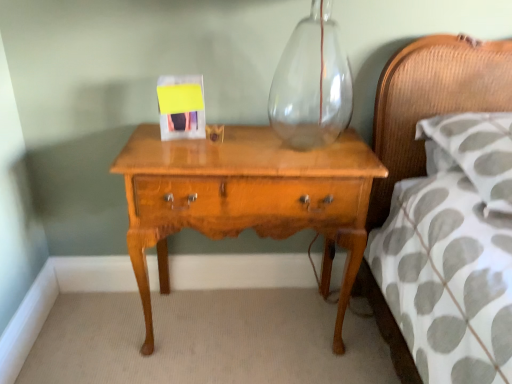
Question: Is white textured pillow at right at the back of light brown wood nightstand at center?

Choices:
 (A) no
 (B) yes

Answer: (A)

Question: Can you confirm if light brown wood nightstand at center is positioned to the left of white textured pillow at right?

Choices:
 (A) no
 (B) yes

Answer: (B)

Question: Is light brown wood nightstand at center at the right side of white textured pillow at right?

Choices:
 (A) no
 (B) yes

Answer: (A)

Question: From the image's perspective, does light brown wood nightstand at center appear higher than white textured pillow at right?

Choices:
 (A) no
 (B) yes

Answer: (A)

Question: Can you confirm if light brown wood nightstand at center is bigger than white textured pillow at right?

Choices:
 (A) yes
 (B) no

Answer: (A)

Question: Considering the relative sizes of light brown wood nightstand at center and white textured pillow at right in the image provided, is light brown wood nightstand at center shorter than white textured pillow at right?

Choices:
 (A) no
 (B) yes

Answer: (A)

Question: Does white textured pillow at right have a larger size compared to light brown wood nightstand at center?

Choices:
 (A) yes
 (B) no

Answer: (B)

Question: Is white textured pillow at right smaller than light brown wood nightstand at center?

Choices:
 (A) yes
 (B) no

Answer: (A)

Question: Can you confirm if white textured pillow at right is thinner than light brown wood nightstand at center?

Choices:
 (A) yes
 (B) no

Answer: (B)

Question: Does white textured pillow at right have a greater width compared to light brown wood nightstand at center?

Choices:
 (A) no
 (B) yes

Answer: (B)

Question: From a real-world perspective, is white textured pillow at right beneath light brown wood nightstand at center?

Choices:
 (A) yes
 (B) no

Answer: (B)

Question: Is light brown wood nightstand at center at the back of white textured pillow at right?

Choices:
 (A) yes
 (B) no

Answer: (B)

Question: Is light brown wood nightstand at center bigger or smaller than white textured pillow at right?

Choices:
 (A) small
 (B) big

Answer: (B)